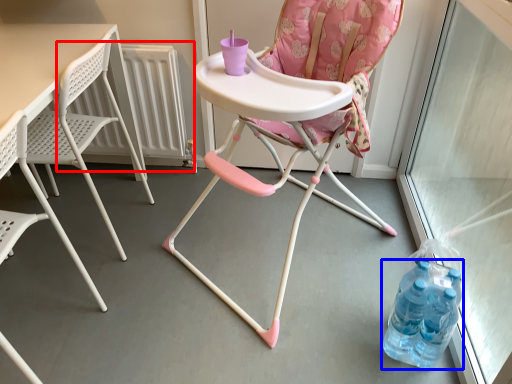
Question: Which object appears closest to the camera in this image, radiator (highlighted by a red box) or bottle (highlighted by a blue box)?

Choices:
 (A) radiator
 (B) bottle

Answer: (B)